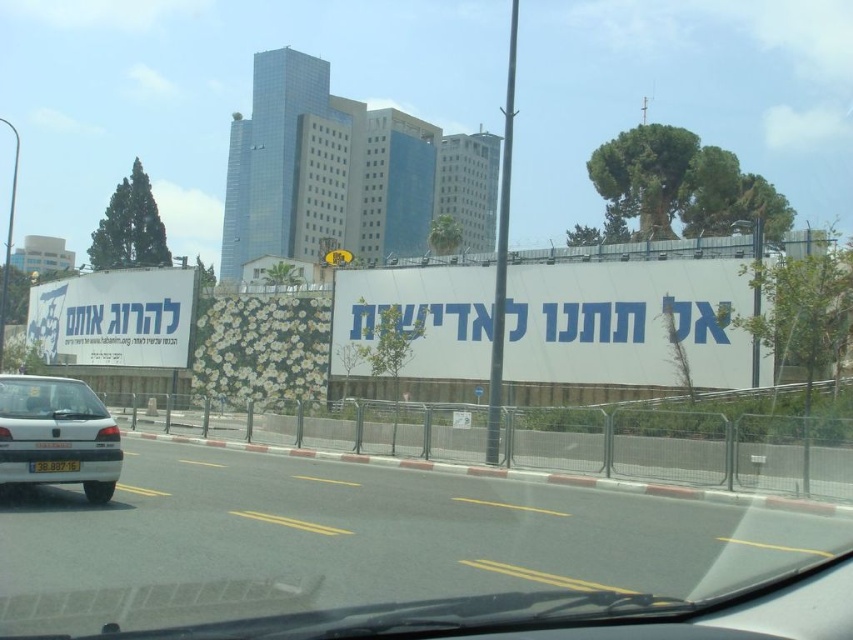
You are a driver in a car and you see a white paper billboard at center and a silver metallic car at left. Which object is wider from your perspective?

The white paper billboard at center might be wider than silver metallic car at left.

You are a passenger in the car and notice the white paper billboard at center and the silver metallic car at left. Which object is closer to you?

The white paper billboard at center is closer to you because the silver metallic car at left is behind it.

You are a passenger in the car and notice two items at the center of your view through the windshield. What is the relationship between the white paper billboard at center and the yellow plastic license plate at center in terms of their positions?

The white paper billboard at center is positioned over the yellow plastic license plate at center, meaning it is closer to you and obscuring part of the license plate.